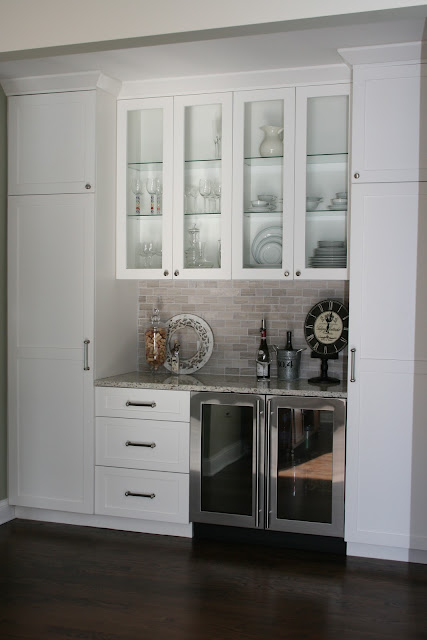
Find the location of a particular element. The image size is (427, 640). fridge right door is located at coordinates (284, 404).